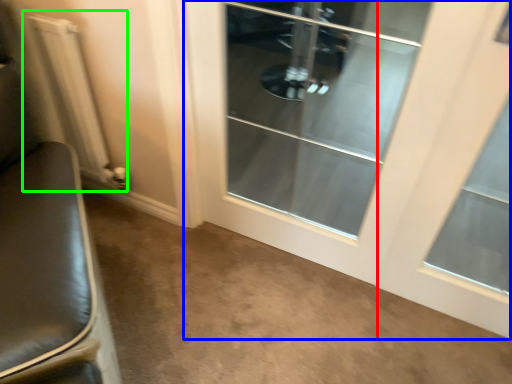
Question: Which object is the closest to the window (highlighted by a red box)? Choose among these: door (highlighted by a blue box) or radiator (highlighted by a green box).

Choices:
 (A) door
 (B) radiator

Answer: (A)